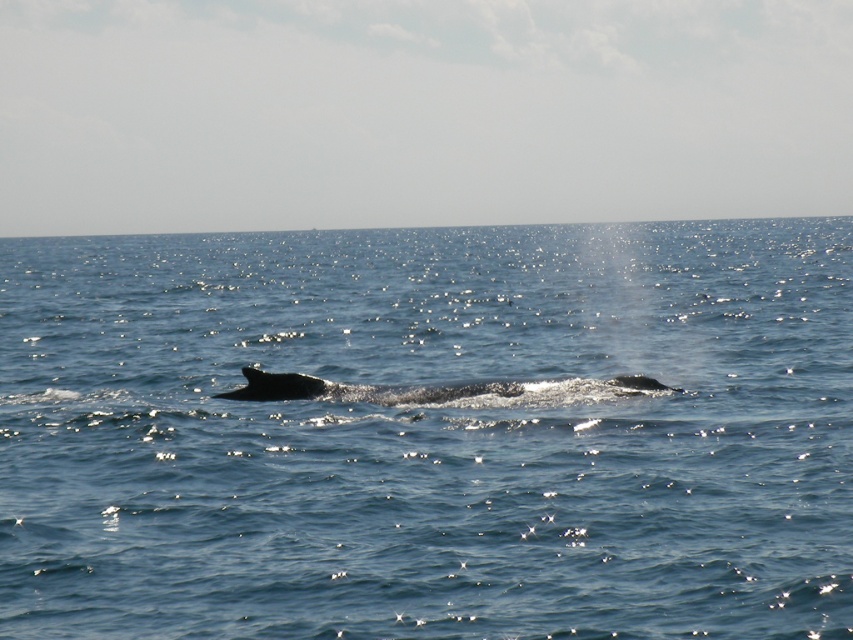
Can you confirm if blue water at center is positioned above gray smooth whale at center?

Indeed, blue water at center is positioned over gray smooth whale at center.

Is blue water at center bigger than gray smooth whale at center?

Correct, blue water at center is larger in size than gray smooth whale at center.

Where is `blue water at center`? blue water at center is located at coordinates (428, 433).